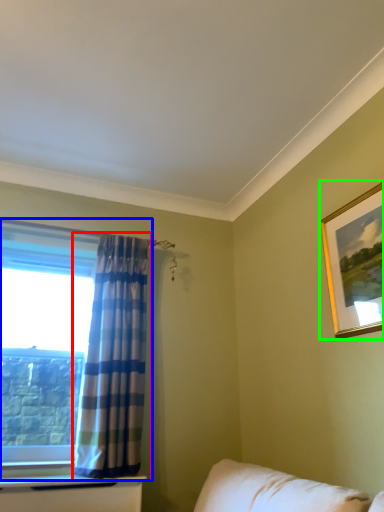
Question: Which object is positioned closest to curtain (highlighted by a red box)? Select from window (highlighted by a blue box) and picture frame (highlighted by a green box).

Choices:
 (A) window
 (B) picture frame

Answer: (A)